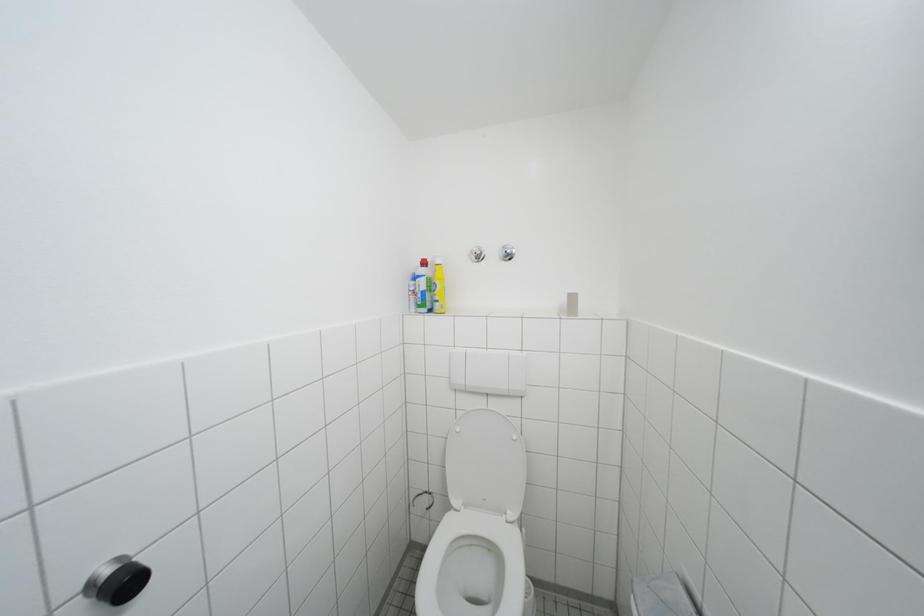
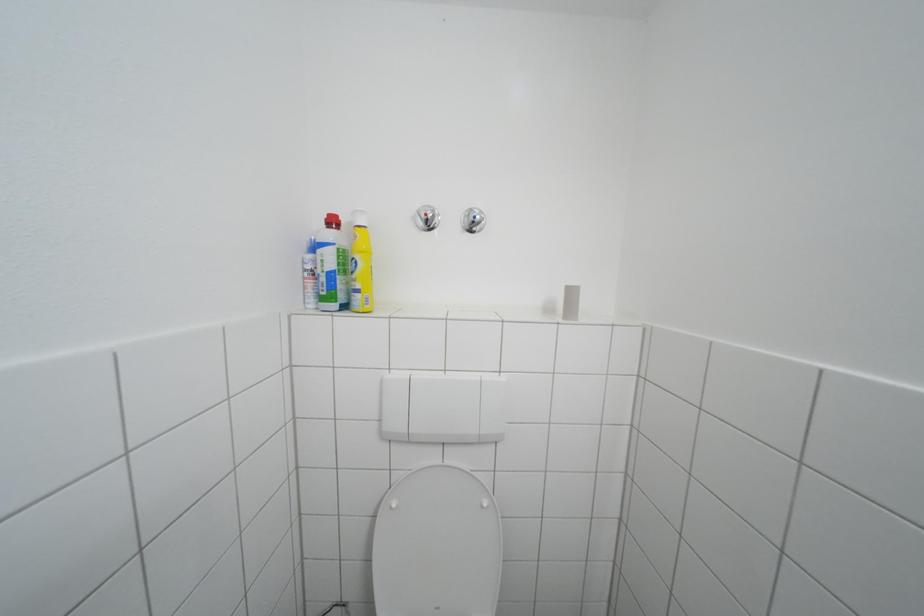
Question: The images are taken continuously from a first-person perspective. In which direction are you moving?

Choices:
 (A) Left
 (B) Right
 (C) Forward
 (D) Backward

Answer: (C)